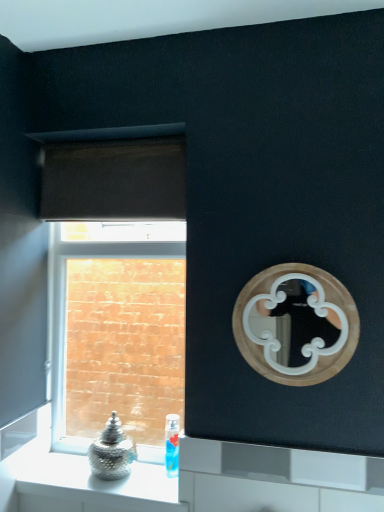
Question: From the image's perspective, is brown fabric curtain at upper left above translucent plastic bottle at lower center?

Choices:
 (A) yes
 (B) no

Answer: (A)

Question: Is brown fabric curtain at upper left aimed at translucent plastic bottle at lower center?

Choices:
 (A) yes
 (B) no

Answer: (B)

Question: Is brown fabric curtain at upper left positioned before translucent plastic bottle at lower center?

Choices:
 (A) yes
 (B) no

Answer: (A)

Question: Is brown fabric curtain at upper left taller than translucent plastic bottle at lower center?

Choices:
 (A) yes
 (B) no

Answer: (A)

Question: Is brown fabric curtain at upper left beside translucent plastic bottle at lower center?

Choices:
 (A) no
 (B) yes

Answer: (A)

Question: From a real-world perspective, is metallic glass jar at lower left physically located above or below brick textured wall at left?

Choices:
 (A) above
 (B) below

Answer: (B)

Question: In the image, is metallic glass jar at lower left on the left side or the right side of brick textured wall at left?

Choices:
 (A) left
 (B) right

Answer: (B)

Question: Does point (130, 479) appear closer or farther from the camera than point (79, 366)?

Choices:
 (A) closer
 (B) farther

Answer: (A)

Question: Is metallic glass jar at lower left taller or shorter than brick textured wall at left?

Choices:
 (A) short
 (B) tall

Answer: (A)

Question: Choose the correct answer: Is brick textured wall at left inside brown fabric curtain at upper left or outside it?

Choices:
 (A) inside
 (B) outside

Answer: (B)

Question: In the image, is brick textured wall at left on the left side or the right side of brown fabric curtain at upper left?

Choices:
 (A) left
 (B) right

Answer: (B)

Question: Is brick textured wall at left wider or thinner than brown fabric curtain at upper left?

Choices:
 (A) thin
 (B) wide

Answer: (B)

Question: Does point 94,392 appear closer or farther from the camera than point 112,140?

Choices:
 (A) closer
 (B) farther

Answer: (B)

Question: From the image's perspective, is brown fabric curtain at upper left positioned above or below brick textured wall at left?

Choices:
 (A) below
 (B) above

Answer: (B)

Question: Which is correct: brown fabric curtain at upper left is inside brick textured wall at left, or outside of it?

Choices:
 (A) outside
 (B) inside

Answer: (A)